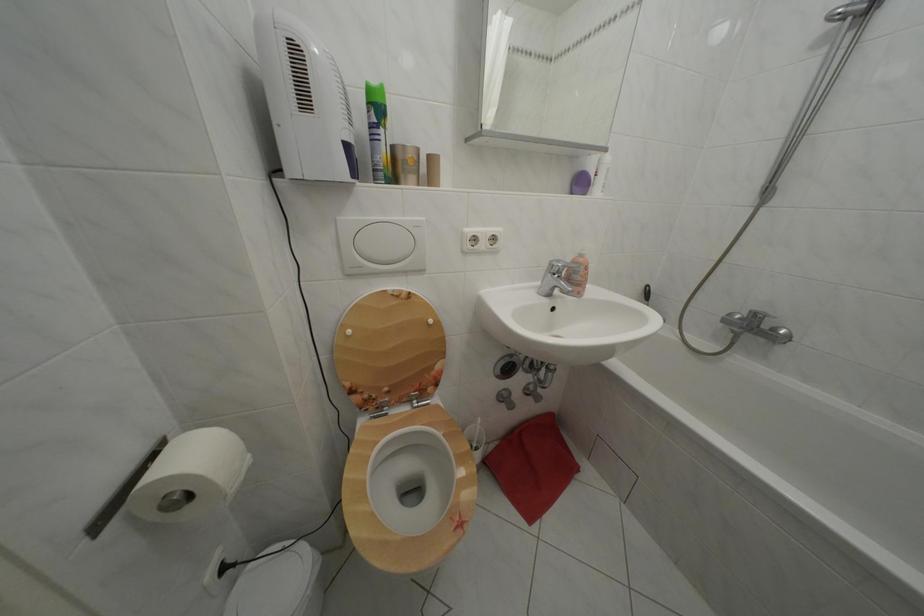
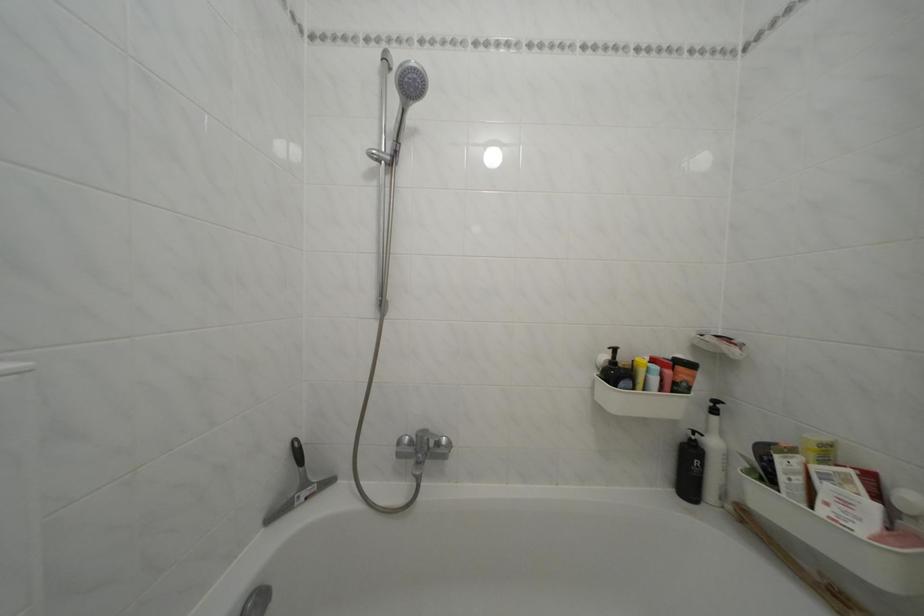
Question: The camera is either moving clockwise (left) or counter-clockwise (right) around the object. The first image is from the beginning of the video and the second image is from the end. Is the camera moving left or right when shooting the video?

Choices:
 (A) Left
 (B) Right

Answer: (A)